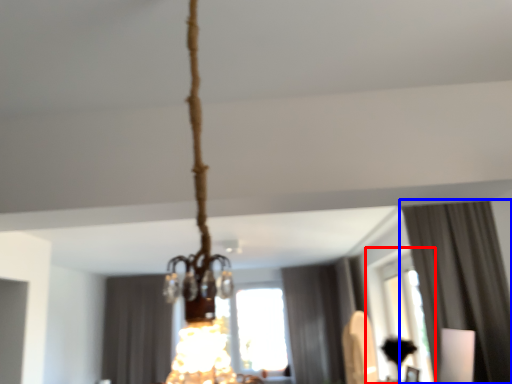
Question: Which point is closer to the camera, window (highlighted by a red box) or curtain (highlighted by a blue box)?

Choices:
 (A) window
 (B) curtain

Answer: (B)